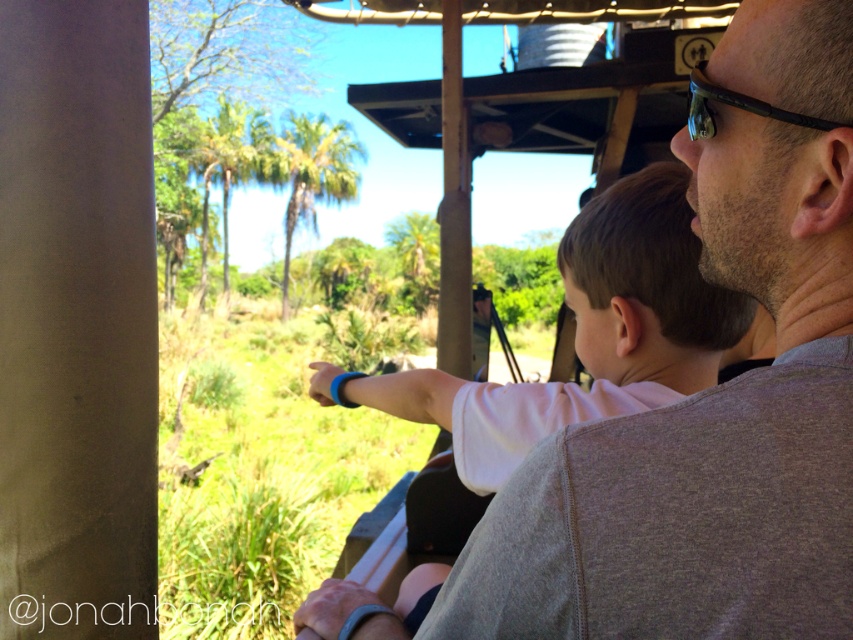
You are inside a safari vehicle and want to reach the point marked as point (697,337). The vehicle has a clearance of 4 feet. Can you safely step out of the vehicle to reach that point?

The distance between you and point (697,337) is 4.43 feet. Since the vehicle has a clearance of 4 feet, stepping out would require reaching 0.43 feet beyond the clearance, making it unsafe. Therefore, you should not step out.

Based on the photo, you are a photographer trying to capture a clear shot of the black plastic sunglasses at upper right while also including the white cotton shirt at center in the frame. Given their sizes, which object should you focus on first to ensure both are in the shot?

The white cotton shirt at center is larger in size than the black plastic sunglasses at upper right, so you should focus on the white cotton shirt at center first to ensure both are in the shot.

You are a tour guide in the safari vehicle. You notice a point marked at coordinates (584, 333). What object is located at that point?

The point at coordinates (584, 333) marks the white cotton shirt at center.